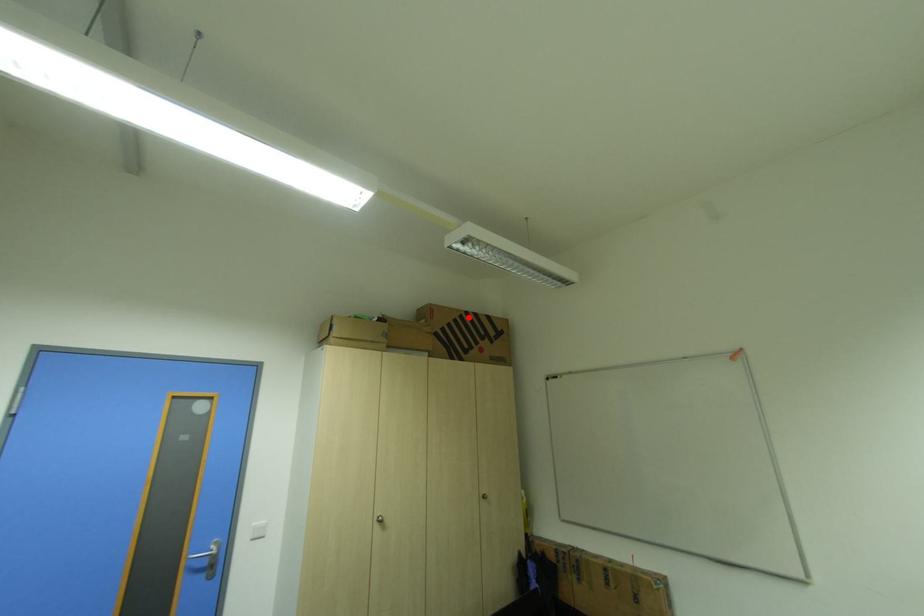
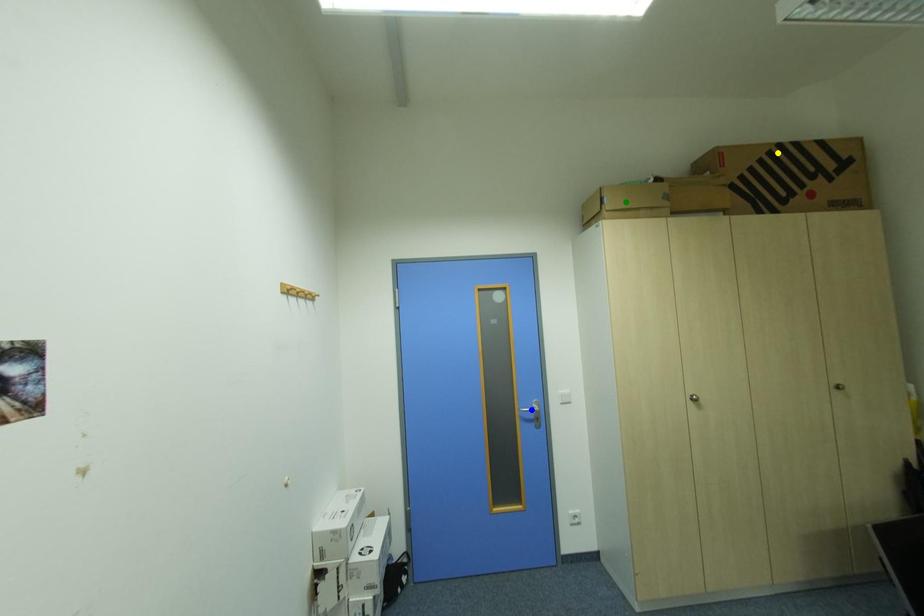
Question: I am providing you with two images of the same scene from different viewpoints. A red point is marked on the first image. You are given multiple points on the second image. Which point in image 2 is actually the same real-world point as the red point in image 1?

Choices:
 (A) blue point
 (B) green point
 (C) yellow point

Answer: (C)